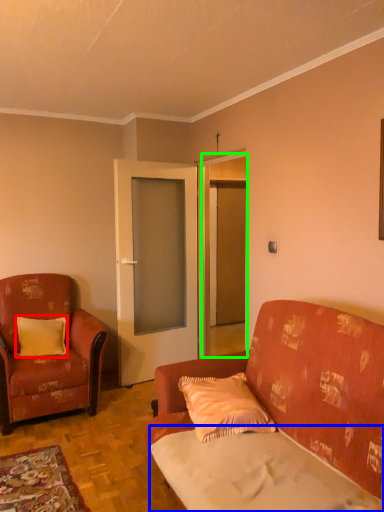
Question: Which object is positioned closest to pillow (highlighted by a red box)? Select from sheet (highlighted by a blue box) and door (highlighted by a green box).

Choices:
 (A) sheet
 (B) door

Answer: (B)